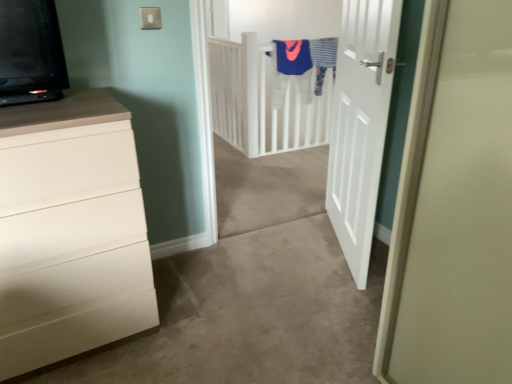
Question: Is point (283, 100) positioned closer to the camera than point (379, 132)?

Choices:
 (A) closer
 (B) farther

Answer: (B)

Question: In the image, is blue fabric robe at upper center positioned in front of or behind white matte door at center?

Choices:
 (A) front
 (B) behind

Answer: (B)

Question: Which object is positioned farthest from the white plastic electric outlet at upper center?

Choices:
 (A) blue fabric robe at upper center
 (B) white matte door at center
 (C) white matte chest of drawers at left
 (D) striped fabric at upper center

Answer: (D)

Question: Estimate the real-world distances between objects in this image. Which object is farther from the blue fabric robe at upper center?

Choices:
 (A) striped fabric at upper center
 (B) white matte door at center
 (C) white matte chest of drawers at left
 (D) white plastic electric outlet at upper center

Answer: (C)